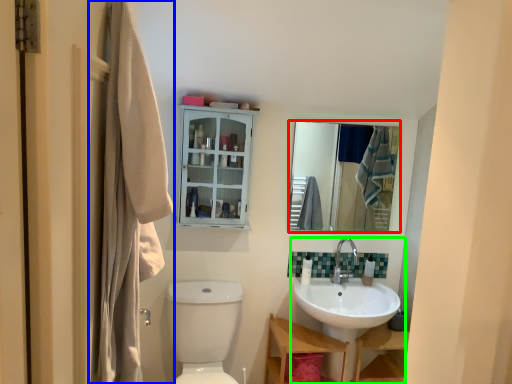
Question: Estimate the real-world distances between objects in this image. Which object is closer to mirror (highlighted by a red box), laundry (highlighted by a blue box) or sink (highlighted by a green box)?

Choices:
 (A) laundry
 (B) sink

Answer: (B)